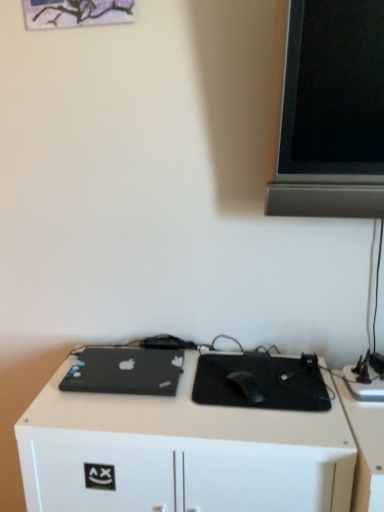
This screenshot has height=512, width=384. Find the location of `free space in front of black matte mouse at center`. free space in front of black matte mouse at center is located at coordinates (258, 425).